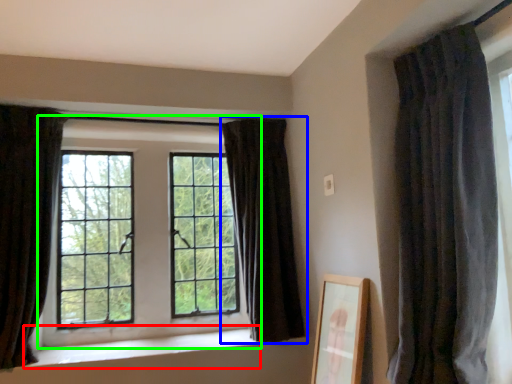
Question: Which object is the closest to the window sill (highlighted by a red box)? Choose among these: curtain (highlighted by a blue box) or window (highlighted by a green box).

Choices:
 (A) curtain
 (B) window

Answer: (B)